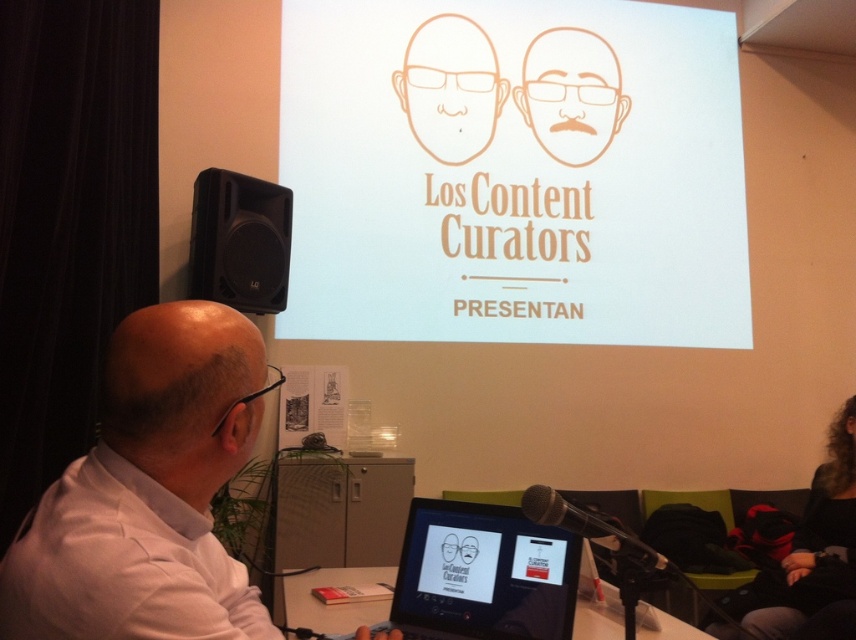
You are standing in the presentation room and want to place a 20 inch wide decorative item on the floor. The point where you want to place it is at point (x=152, y=476). Considering the distance from you to that point is 34.25 inches, will the decorative item fit without overlapping the speaker mounted on the wall to the left?

The distance from you to the point (x=152, y=476) is 34.25 inches. Since the decorative item is 20 inches wide, it will fit at that location without overlapping the speaker as long as there is enough space along the depth. However, the description does not provide information about the speaker dimensions or its exact position relative to the point, so we cannot confirm overlap with certainty.

You are an attendee at the presentation. You want to take a photo of the curly hair at lower right and the matte orange face at upper center. Which object should you focus on first to ensure both are in focus?

The curly hair at lower right is closer to the viewer than the matte orange face at upper center. To ensure both are in focus, focus on the curly hair at lower right first since it is closer.